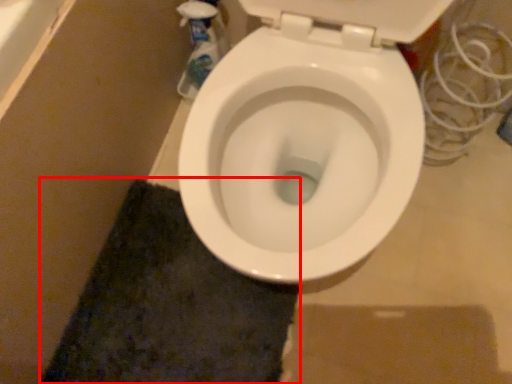
Question: From the image's perspective, what is the correct spatial positioning of bath mat (annotated by the red box) in reference to cleaning product?

Choices:
 (A) above
 (B) below

Answer: (B)